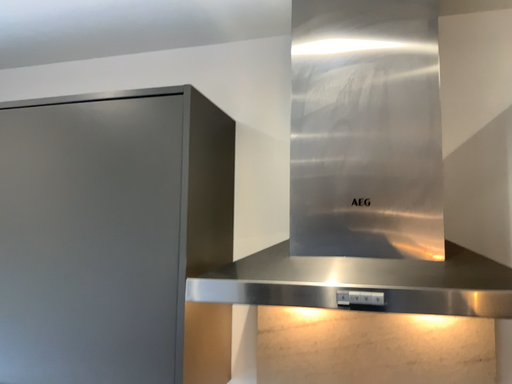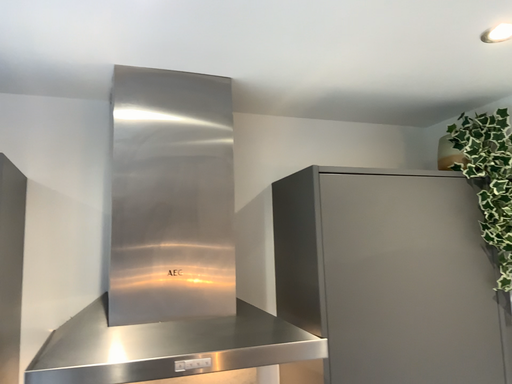
Question: How did the camera likely rotate when shooting the video?

Choices:
 (A) rotated left
 (B) rotated right

Answer: (B)